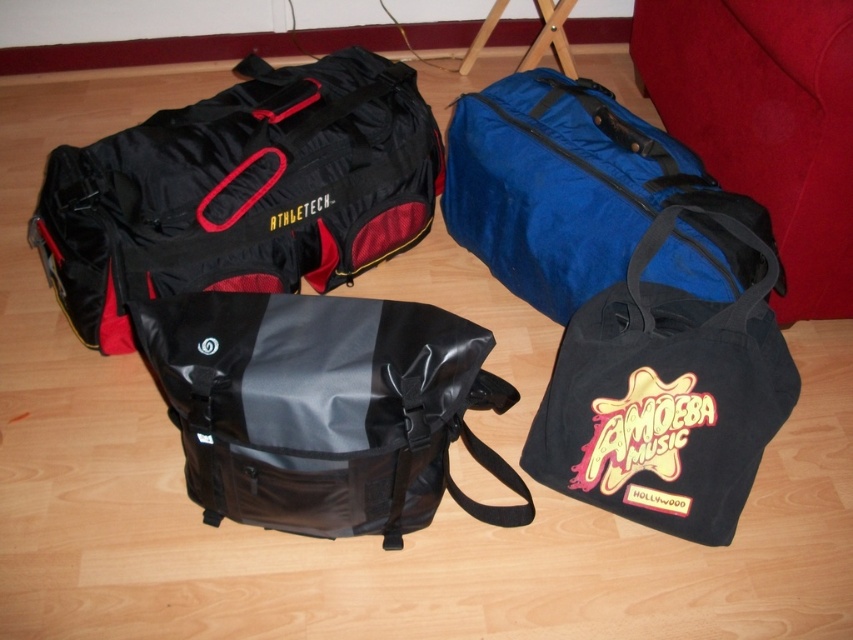
Question: Which of the following is the closest to the observer?

Choices:
 (A) (221, 141)
 (B) (486, 244)
 (C) (556, 356)

Answer: (A)

Question: Which point is closer to the camera?

Choices:
 (A) black canvas tote at lower right
 (B) red fabric couch at upper right
 (C) blue fabric duffel at upper right
 (D) black matte duffel bag at left

Answer: (B)

Question: Is black matte duffel bag at left smaller than wooden stool at center?

Choices:
 (A) no
 (B) yes

Answer: (A)

Question: From the image, what is the correct spatial relationship of black matte duffel bag at left in relation to red fabric couch at upper right?

Choices:
 (A) right
 (B) left

Answer: (B)

Question: Is black matte duffel bag at left closer to the viewer compared to red fabric couch at upper right?

Choices:
 (A) no
 (B) yes

Answer: (A)

Question: Which point appears closest to the camera in this image?

Choices:
 (A) (325, 216)
 (B) (828, 310)
 (C) (564, 60)

Answer: (B)